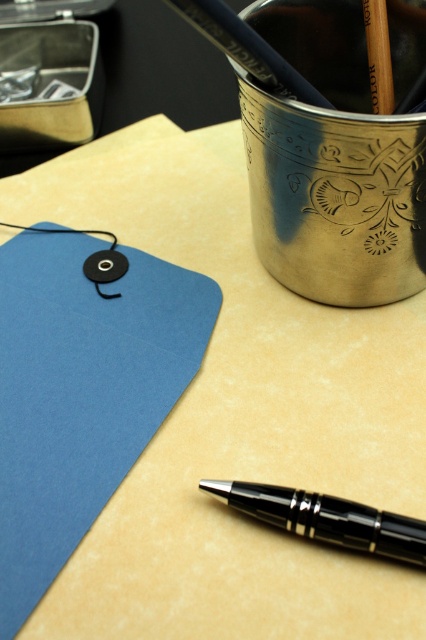
Question: Which point appears farthest from the camera in this image?

Choices:
 (A) (68, 305)
 (B) (279, 522)

Answer: (A)

Question: Considering the relative positions of matte blue paper at upper left and black polished pen at lower right in the image provided, where is matte blue paper at upper left located with respect to black polished pen at lower right?

Choices:
 (A) below
 (B) above

Answer: (B)

Question: Is matte blue paper at upper left positioned at the back of black polished pen at lower right?

Choices:
 (A) yes
 (B) no

Answer: (B)

Question: Which of the following is the closest to the observer?

Choices:
 (A) matte blue paper at upper left
 (B) black polished pen at lower right

Answer: (A)

Question: Can you confirm if matte blue paper at upper left is positioned below black polished pen at lower right?

Choices:
 (A) yes
 (B) no

Answer: (B)